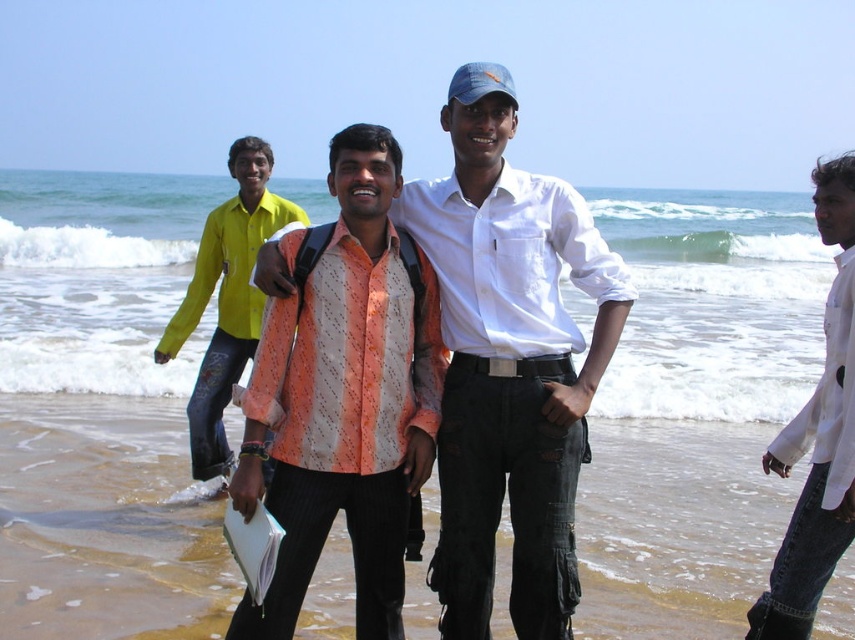
From the picture: You are a photographer setting up a camera to take a group photo of the two men on the beach. The camera requires at least 1.2 meters between subjects to focus properly. Based on the scene, will the current distance between the white cotton shirt at center and the patterned fabric shirt at center allow the camera to focus?

The white cotton shirt at center is 1.18 meters from the patterned fabric shirt at center, which is slightly less than the required 1.2 meters. Therefore, the camera may not focus properly, and the subjects should move slightly farther apart.

You are a photographer trying to arrange two people in a photo shoot. You have a patterned fabric shirt at center and a yellow cotton shirt at center. If you want to place them side by side so that the thinner one is on the left, which shirt should you put on the left side?

The patterned fabric shirt at center is thinner than the yellow cotton shirt at center, so you should place the patterned fabric shirt at center on the left side.